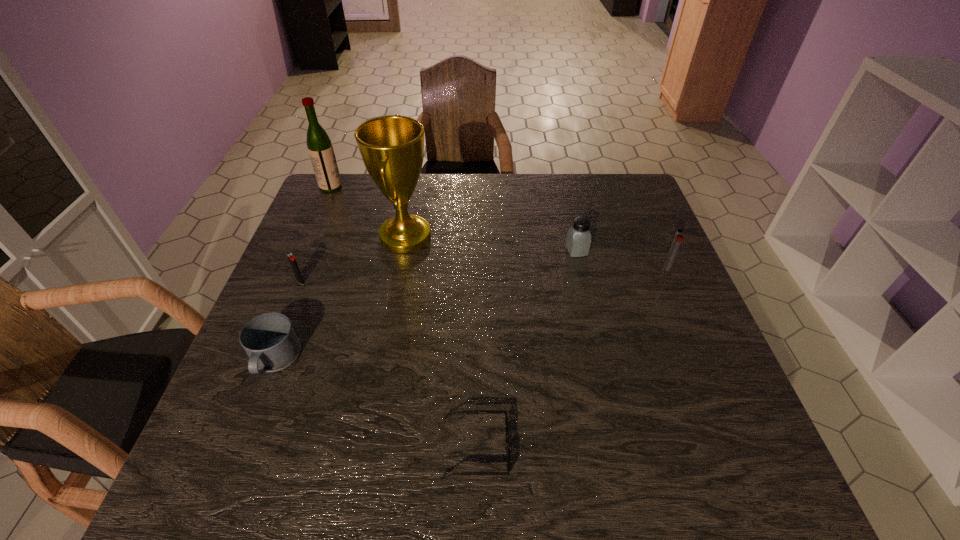
This screenshot has width=960, height=540. What are the coordinates of `sunglasses` in the screenshot? It's located at (507, 449).

The image size is (960, 540). In order to click on vacant space located 0.340m by the handles of the award in this screenshot , I will do `click(555, 237)`.

Where is `vacant point located on the label of the liquor`? vacant point located on the label of the liquor is located at coordinates (432, 187).

Locate an element on the screen. This screenshot has width=960, height=540. free space located 0.250m on the back of the taller igniter is located at coordinates (640, 207).

The image size is (960, 540). I want to click on free space located on the right of the sixth object from left to right, so click(660, 251).

The image size is (960, 540). Identify the location of vacant space located 0.080m on the back of the shorter igniter. (310, 257).

Where is `free space located on the side of the mug with the handle`? The height and width of the screenshot is (540, 960). free space located on the side of the mug with the handle is located at coordinates (246, 435).

Locate an element on the screen. vacant space located at the front lenses of the sunglasses is located at coordinates (720, 449).

The image size is (960, 540). I want to click on award located at the far edge, so click(x=392, y=147).

You are a GUI agent. You are given a task and a screenshot of the screen. Output one action in this format:
    pyautogui.click(x=<x>, y=<y>)
    Task: Click on the liquor at the far edge
    
    Given the screenshot: What is the action you would take?
    pyautogui.click(x=320, y=148)